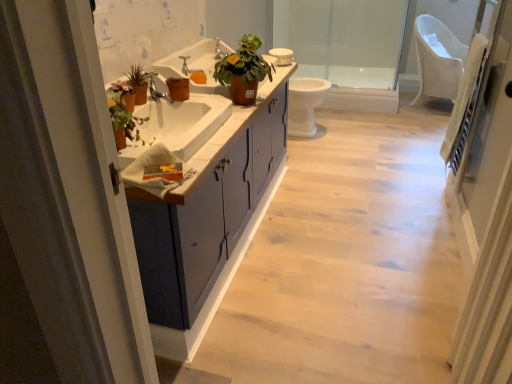
Where is `free space in front of white glossy toilet at center`? Image resolution: width=512 pixels, height=384 pixels. free space in front of white glossy toilet at center is located at coordinates (x=331, y=149).